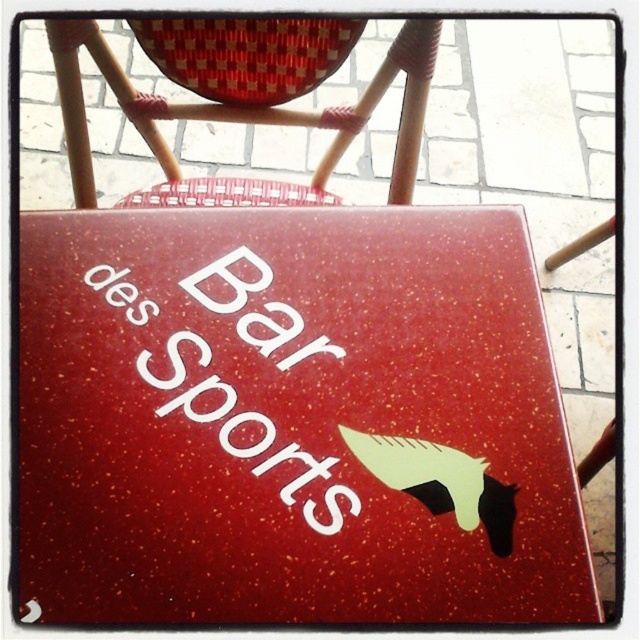
Question: Can you confirm if glossy speckled table at center is positioned below white speckled paper at center?

Choices:
 (A) yes
 (B) no

Answer: (A)

Question: Is woven rattan chair at upper left positioned before white speckled paper at center?

Choices:
 (A) yes
 (B) no

Answer: (B)

Question: Among these points, which one is farthest from the camera?

Choices:
 (A) pyautogui.click(x=420, y=108)
 (B) pyautogui.click(x=285, y=458)

Answer: (A)

Question: Considering the relative positions of glossy speckled table at center and white speckled paper at center in the image provided, where is glossy speckled table at center located with respect to white speckled paper at center?

Choices:
 (A) above
 (B) below

Answer: (B)

Question: Among these points, which one is nearest to the camera?

Choices:
 (A) (236, 186)
 (B) (202, 298)
 (C) (260, 522)

Answer: (C)

Question: Which of the following is the farthest from the observer?

Choices:
 (A) woven rattan chair at upper left
 (B) white speckled paper at center
 (C) glossy speckled table at center

Answer: (A)